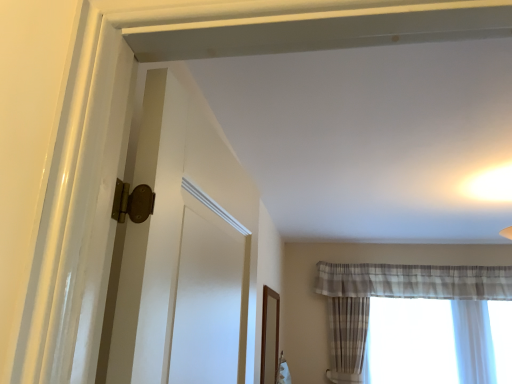
Question: Is plaid sheer curtain at right to the right of plaid fabric curtain at right from the viewer's perspective?

Choices:
 (A) no
 (B) yes

Answer: (A)

Question: From a real-world perspective, is plaid sheer curtain at right on top of plaid fabric curtain at right?

Choices:
 (A) no
 (B) yes

Answer: (B)

Question: Would you say plaid sheer curtain at right is a long distance from plaid fabric curtain at right?

Choices:
 (A) yes
 (B) no

Answer: (B)

Question: Can you confirm if plaid sheer curtain at right is positioned to the left of plaid fabric curtain at right?

Choices:
 (A) yes
 (B) no

Answer: (A)

Question: Is plaid sheer curtain at right aimed at plaid fabric curtain at right?

Choices:
 (A) yes
 (B) no

Answer: (A)

Question: Is plaid sheer curtain at right bigger than plaid fabric curtain at right?

Choices:
 (A) no
 (B) yes

Answer: (B)

Question: From a real-world perspective, is plaid fabric curtain at right under plaid sheer curtain at right?

Choices:
 (A) yes
 (B) no

Answer: (A)

Question: Does plaid fabric curtain at right have a smaller size compared to plaid sheer curtain at right?

Choices:
 (A) no
 (B) yes

Answer: (B)

Question: Is plaid fabric curtain at right shorter than plaid sheer curtain at right?

Choices:
 (A) yes
 (B) no

Answer: (A)

Question: From the image's perspective, is plaid fabric curtain at right below plaid sheer curtain at right?

Choices:
 (A) no
 (B) yes

Answer: (B)

Question: Can you see plaid fabric curtain at right touching plaid sheer curtain at right?

Choices:
 (A) no
 (B) yes

Answer: (A)

Question: Is plaid sheer curtain at right surrounded by plaid fabric curtain at right?

Choices:
 (A) no
 (B) yes

Answer: (A)

Question: Is point (453, 296) closer or farther from the camera than point (432, 324)?

Choices:
 (A) farther
 (B) closer

Answer: (A)